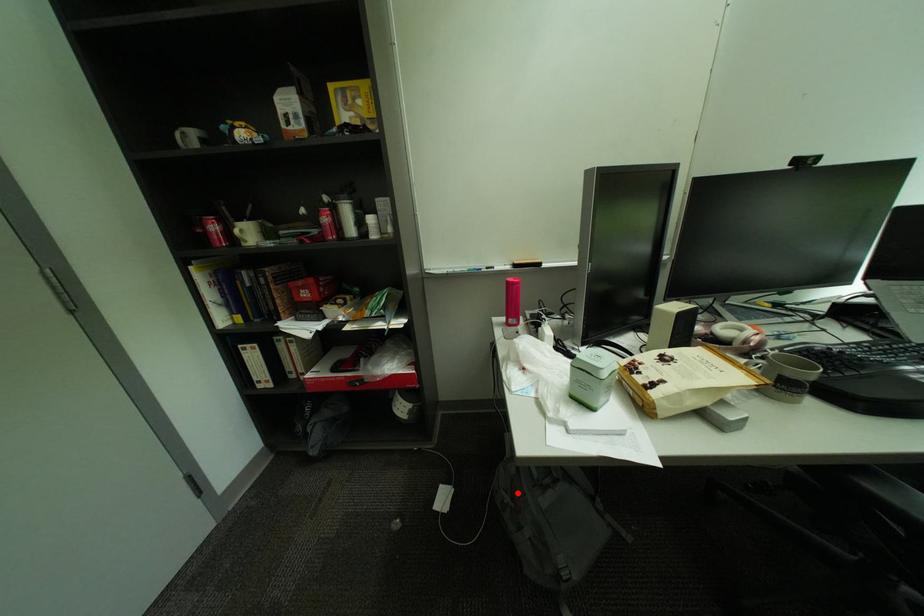
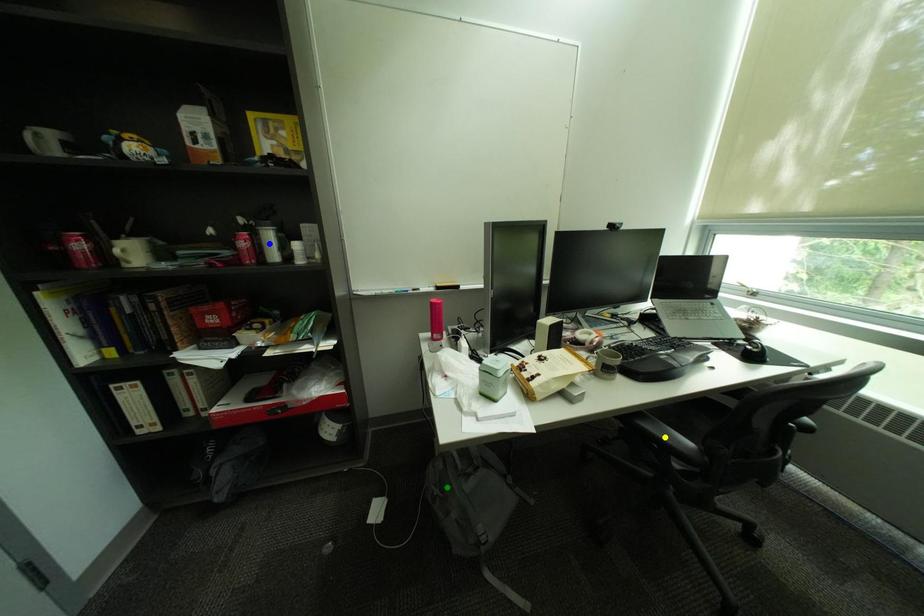
Question: I am providing you with two images of the same scene from different viewpoints. A red point is marked on the first image. You are given multiple points on the second image. Can you choose the point in image 2 that corresponds to the point in image 1?

Choices:
 (A) yellow point
 (B) green point
 (C) blue point

Answer: (B)